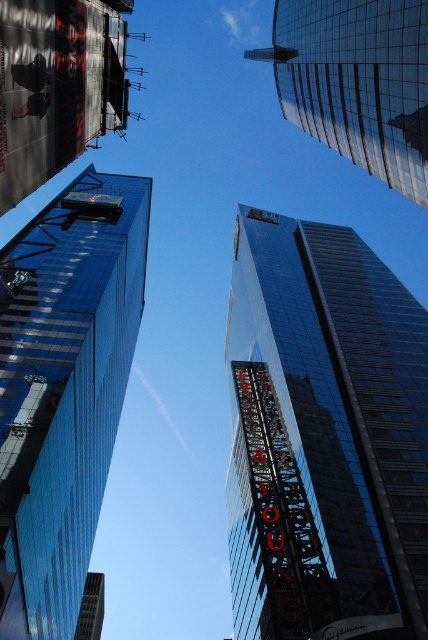
You are a drone operator tasked with flying a drone between two shiny glass skyscrapers. The drone has a maximum flight distance of 150 feet. Given the scene described, can your drone safely fly between the shiny glass skyscraper at left and the shiny glass skyscraper at upper center?

The shiny glass skyscraper at left and the shiny glass skyscraper at upper center are 159.91 feet apart. Since the drone has a maximum flight distance of 150 feet, it cannot safely fly between them as the distance exceeds its capability.

You are standing at the base of the central skyscraper and looking upward. You notice two points marked in the image. The first point is at coordinates point (86, 440), and the second is at point (397, 113). Which point is closer to your current position?

Point (86, 440) is behind point (397, 113), so the point closer to your current position at the base is point (397, 113).

You are standing on the street looking up at the city skyline. You notice two buildings in the image. Which one is positioned lower in the view? The black glass building at center and the shiny glass skyscraper at upper center.

The black glass building at center is located below the shiny glass skyscraper at upper center, so the black glass building at center is positioned lower in the view.